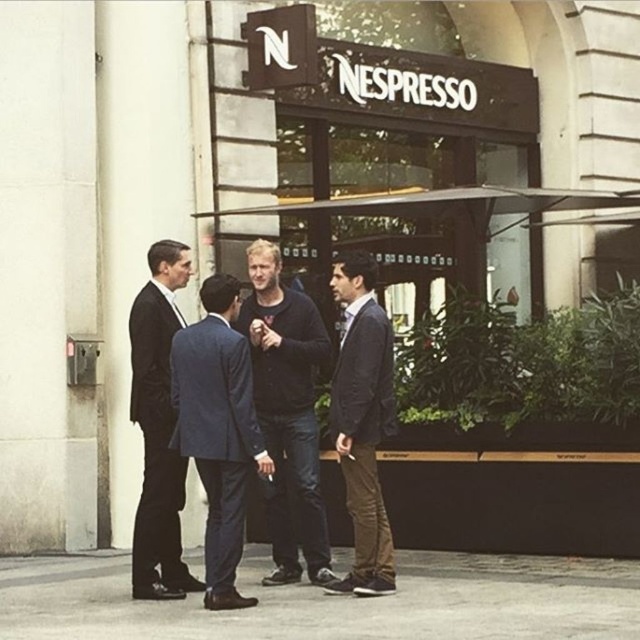
Question: Is dark blue jeans at center smaller than dark blue suit at center?

Choices:
 (A) yes
 (B) no

Answer: (B)

Question: Which of these objects is positioned closest to the dark blue suit at center?

Choices:
 (A) blue fabric suit at center
 (B) dark blue jeans at center

Answer: (B)

Question: Is dark blue suit at center bigger than black suit at left?

Choices:
 (A) yes
 (B) no

Answer: (B)

Question: Can you confirm if dark blue suit at center is wider than black suit at left?

Choices:
 (A) yes
 (B) no

Answer: (B)

Question: Which point is farther to the camera?

Choices:
 (A) blue fabric suit at center
 (B) black suit at left
 (C) dark blue jeans at center

Answer: (C)

Question: Among these points, which one is nearest to the camera?

Choices:
 (A) (372, 378)
 (B) (154, 392)
 (C) (260, 280)

Answer: (A)